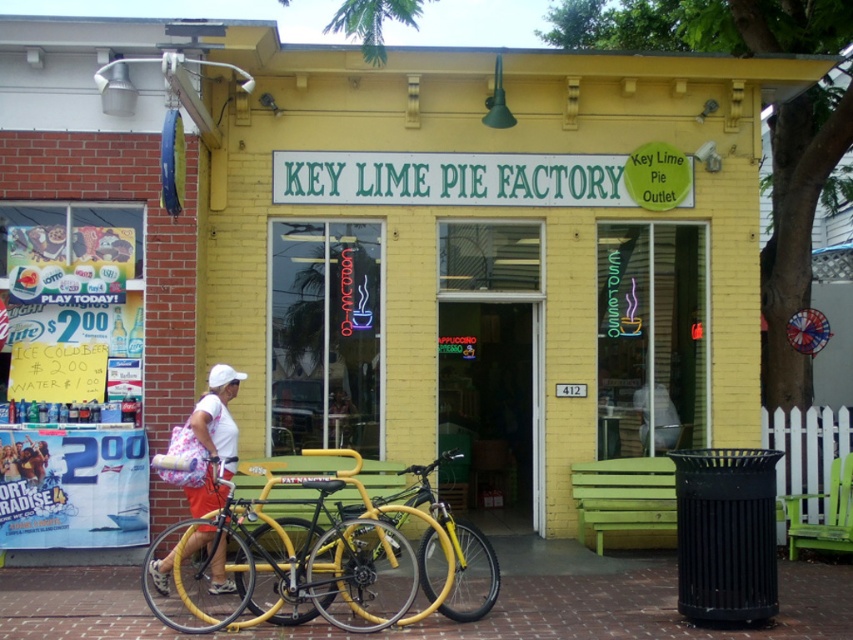
You are a customer arriving at the Key Lime Pie Factory. You see a yellow matte bicycle at lower left and a white fabric bag at lower left. Which item is closer to the entrance?

The yellow matte bicycle at lower left is positioned under the white fabric bag at lower left, so the white fabric bag at lower left is closer to the entrance.

You are a delivery person who needs to carry a package using the white fabric bag at lower left. The package is as wide as the yellow matte bicycle at center. Will the bag be wide enough to fit the package?

The yellow matte bicycle at center is wider than the white fabric bag at lower left. Since the package is as wide as the bicycle, the bag will not be wide enough to fit the package.

You are standing at the entrance of the Key Lime Pie Factory and see a yellow matte bicycle at center and a white fabric bag at lower left. Which object is closer to you?

The yellow matte bicycle at center is closer to the viewer than the white fabric bag at lower left.